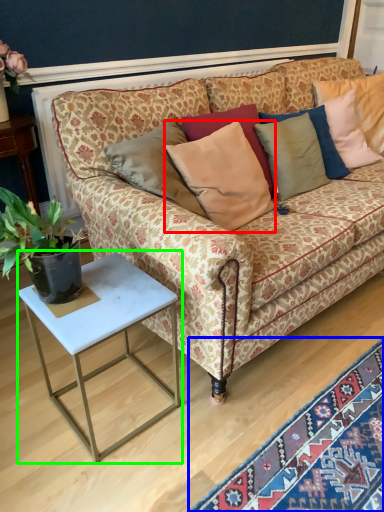
Question: Which object is positioned farthest from pillow (highlighted by a red box)? Select from mat (highlighted by a blue box) and table (highlighted by a green box).

Choices:
 (A) mat
 (B) table

Answer: (A)